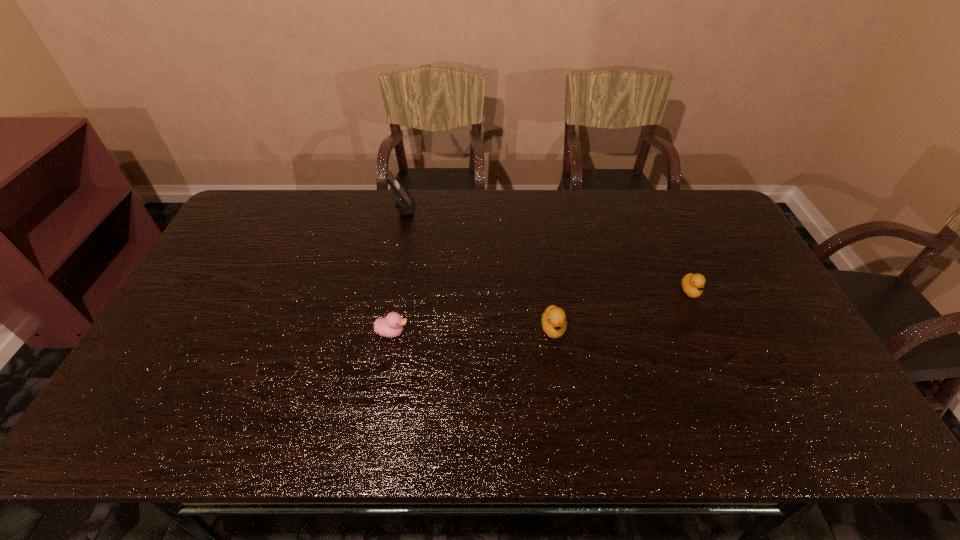
Find the location of a particular element. This screenshot has width=960, height=540. the farthest object is located at coordinates (405, 204).

Image resolution: width=960 pixels, height=540 pixels. In order to click on the tallest object in this screenshot , I will do `click(405, 204)`.

Locate an element on the screen. The width and height of the screenshot is (960, 540). the third object from left to right is located at coordinates (554, 323).

Find the location of `the leftmost duckling`. the leftmost duckling is located at coordinates (390, 326).

Where is `the third nearest object`? the third nearest object is located at coordinates (692, 284).

You are a GUI agent. You are given a task and a screenshot of the screen. Output one action in this format:
    pyautogui.click(x=<x>, y=<y>)
    Task: Click on the farthest duckling
    This screenshot has height=540, width=960.
    Given the screenshot: What is the action you would take?
    pyautogui.click(x=692, y=284)

Locate an element on the screen. vacant space located on the front-facing side of the farthest object is located at coordinates (517, 210).

What are the coordinates of `vacant area situated 0.050m facing forward on the second duckling from left to right` in the screenshot? It's located at (558, 360).

I want to click on free space located on the front-facing side of the leftmost duckling, so click(x=525, y=333).

The image size is (960, 540). I want to click on free space located on the face of the rightmost object, so pyautogui.click(x=749, y=421).